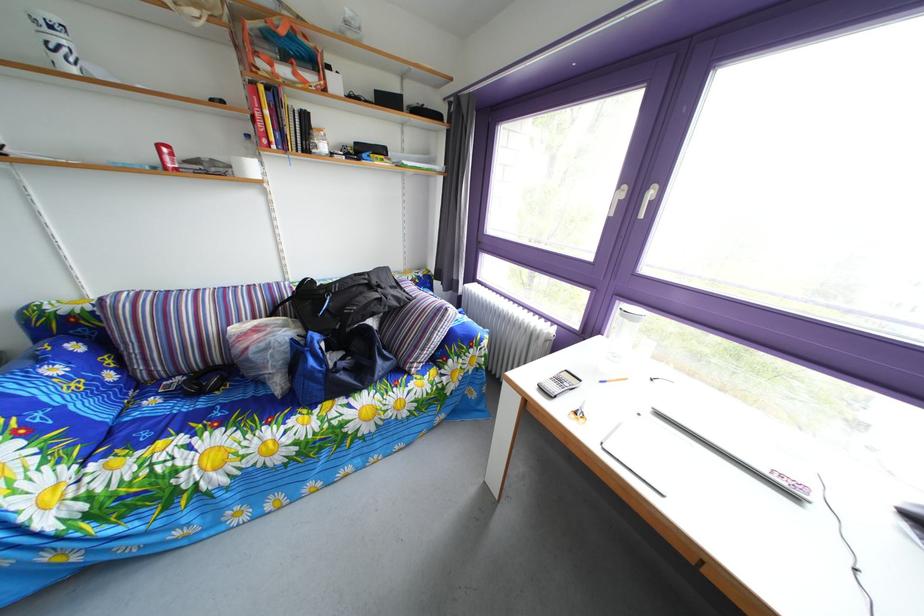
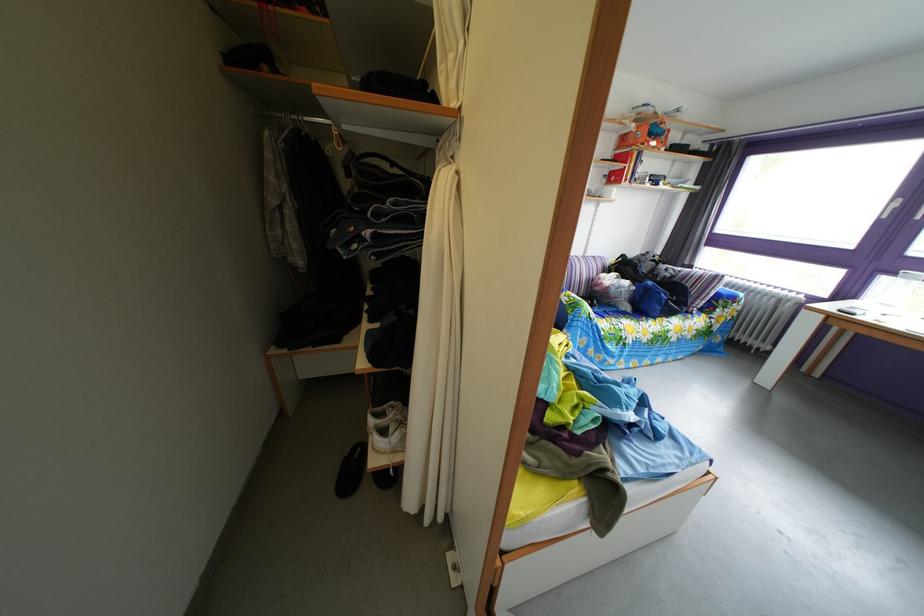
Where in the second image is the point corresponding to pixel 261 138 from the first image?

(618, 180)